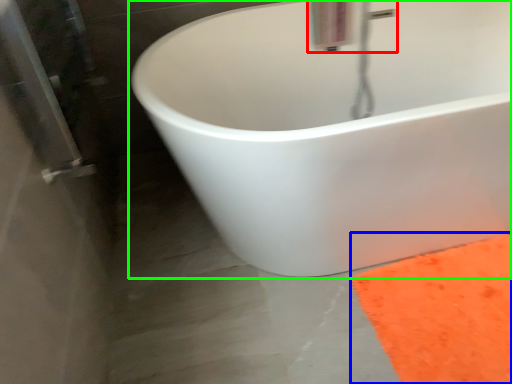
Question: Which object is positioned farthest from plumbing fixture (highlighted by a red box)? Select from doormat (highlighted by a blue box) and bathtub (highlighted by a green box).

Choices:
 (A) doormat
 (B) bathtub

Answer: (A)